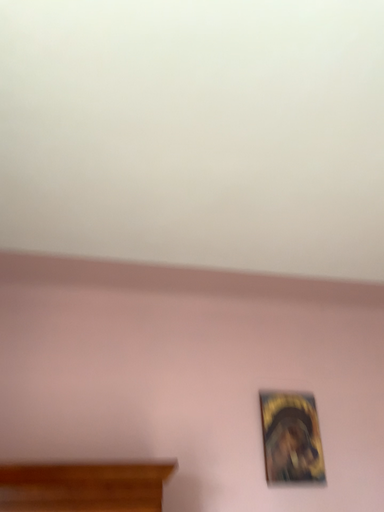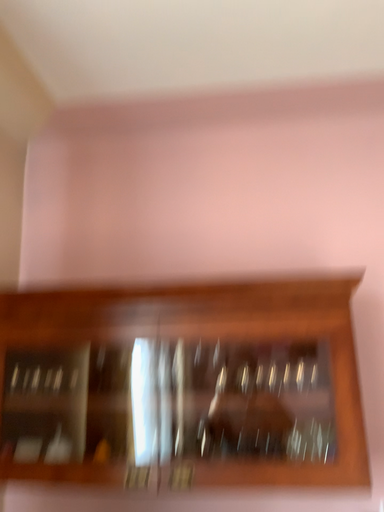
Question: Which way did the camera rotate in the video?

Choices:
 (A) rotated right
 (B) rotated left

Answer: (B)